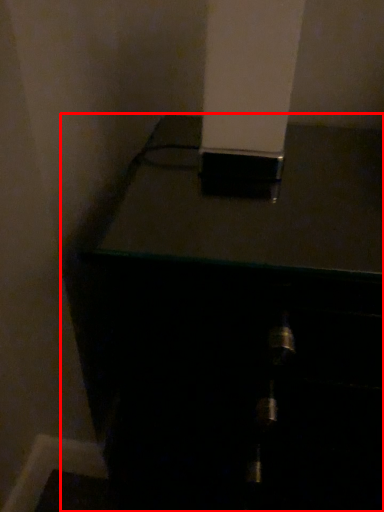
Question: From the image's perspective, considering the relative positions of furniture (annotated by the red box) and pillar in the image provided, where is furniture (annotated by the red box) located with respect to the staircase?

Choices:
 (A) above
 (B) below

Answer: (B)